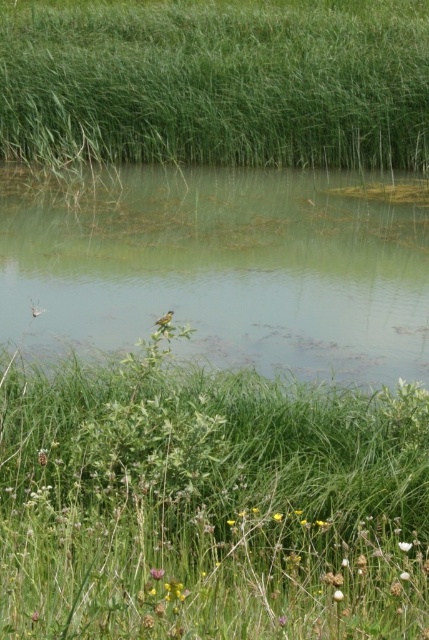
Based on the scene description, which object takes up more area in the image between the green leafy grass at center and the green grassy lake at center?

The green grassy lake at center occupies more area than the green leafy grass at center.

You are a gardener trying to identify the thinnest grass in the scene. Which grass between the green leafy grass at center and the green grass at upper center is thinner?

The green leafy grass at center is thinner than the green grass at upper center.